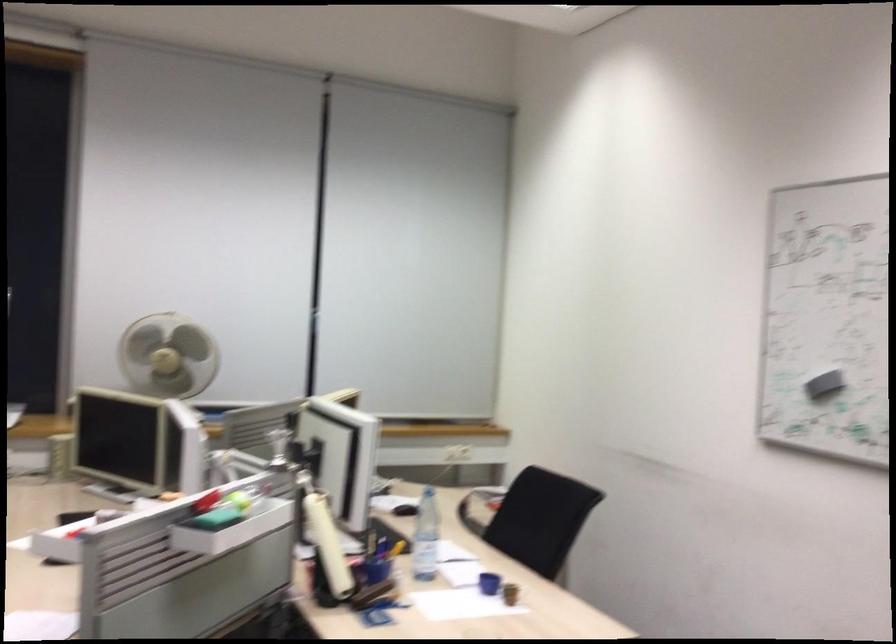
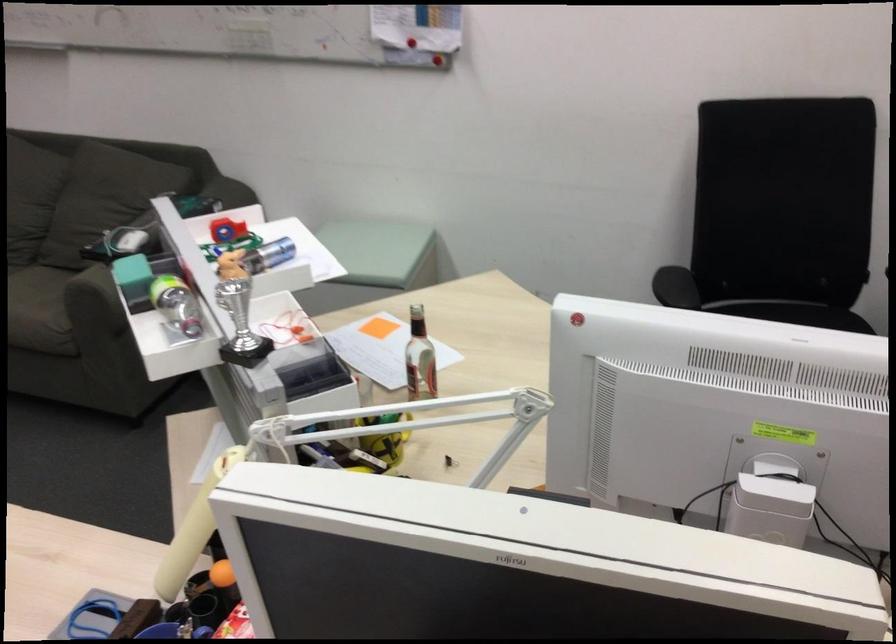
Where in the second image is the point corresponding to point (80, 536) from the first image?

(274, 252)